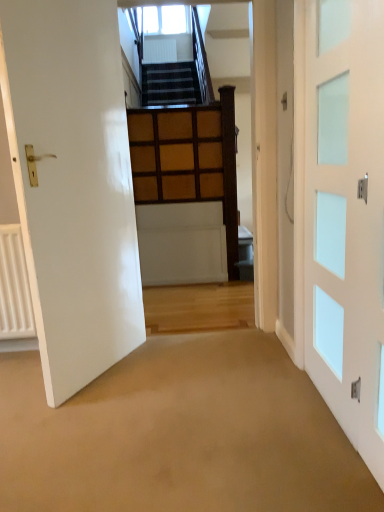
Question: Considering the relative sizes of clear glass window at upper center and white glass door at right, which is the 1th door in right-to-left order, in the image provided, is clear glass window at upper center shorter than white glass door at right, which is the 1th door in right-to-left order,?

Choices:
 (A) no
 (B) yes

Answer: (B)

Question: Is white glass door at right, which appears as the 2th door when viewed from the left, surrounded by clear glass window at upper center?

Choices:
 (A) no
 (B) yes

Answer: (A)

Question: Does clear glass window at upper center have a larger size compared to white glass door at right, which appears as the 2th door when viewed from the left?

Choices:
 (A) yes
 (B) no

Answer: (A)

Question: Is clear glass window at upper center closer to the viewer compared to white glass door at right, which appears as the 2th door when viewed from the left?

Choices:
 (A) no
 (B) yes

Answer: (A)

Question: Is clear glass window at upper center wider than white glass door at right, which appears as the 2th door when viewed from the left?

Choices:
 (A) yes
 (B) no

Answer: (A)

Question: From a real-world perspective, is clear glass window at upper center below white glass door at right, which is the 1th door in right-to-left order?

Choices:
 (A) yes
 (B) no

Answer: (B)

Question: Can you confirm if white glossy door at left, arranged as the 2th door when viewed from the right, is wider than clear glass window at upper center?

Choices:
 (A) yes
 (B) no

Answer: (B)

Question: Is white glossy door at left, arranged as the 2th door when viewed from the right, turned away from clear glass window at upper center?

Choices:
 (A) no
 (B) yes

Answer: (A)

Question: Considering the relative positions of white glossy door at left, the 1th door in the left-to-right sequence, and clear glass window at upper center in the image provided, is white glossy door at left, the 1th door in the left-to-right sequence, in front of clear glass window at upper center?

Choices:
 (A) no
 (B) yes

Answer: (B)

Question: Is white glossy door at left, arranged as the 2th door when viewed from the right, not near clear glass window at upper center?

Choices:
 (A) yes
 (B) no

Answer: (A)

Question: Is white glossy door at left, arranged as the 2th door when viewed from the right, at the right side of clear glass window at upper center?

Choices:
 (A) yes
 (B) no

Answer: (B)

Question: Considering the relative sizes of white glossy door at left, arranged as the 2th door when viewed from the right, and clear glass window at upper center in the image provided, is white glossy door at left, arranged as the 2th door when viewed from the right, shorter than clear glass window at upper center?

Choices:
 (A) no
 (B) yes

Answer: (A)

Question: Is white glass door at right, which is the 1th door in right-to-left order, at the left side of clear glass window at upper center?

Choices:
 (A) no
 (B) yes

Answer: (A)